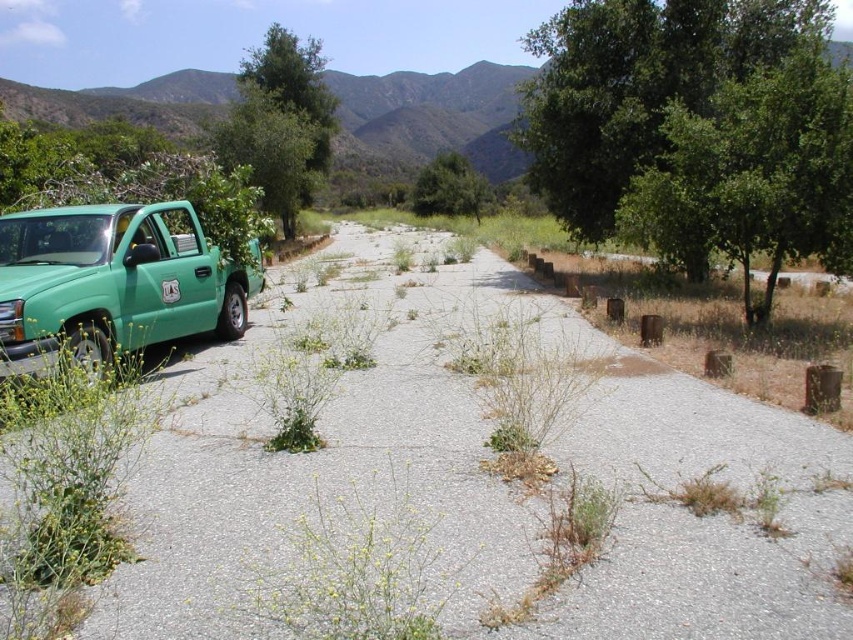
You are standing at the center of the road and want to place a small marker exactly where the gray gravel at left is located. What are the coordinates of the point where you should place the marker?

The coordinates for the gray gravel at left are at point (x=480, y=477).

You are standing at the green leafy tree at upper right and want to cross the road to reach the light teal pickup truck parked on the left side. The road is 29.95 feet wide. Your wheelchair has a maximum turning radius of 30 feet. Can you safely navigate the road to reach the truck?

The distance between you and the light teal pickup truck parked on the left side is 29.95 feet. Since your wheelchair has a maximum turning radius of 30 feet, you can safely navigate the road to reach the truck as the required turning radius is slightly less than your wheelchair can handle.

You are driving a car and see the gray gravel at left and the green leafy tree at center. Which one is closer to your left side?

The gray gravel at left is closer to your left side because it is positioned on the left side of the green leafy tree at center.